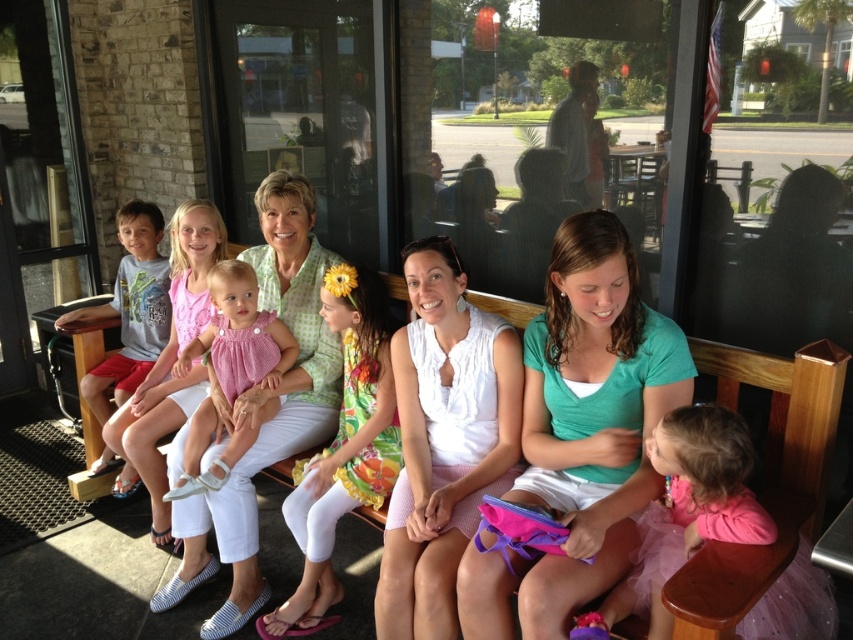
Is polka dot blouse at center positioned at the back of pink tulle skirt at lower right?

Yes.

Is polka dot blouse at center thinner than pink tulle skirt at lower right?

Incorrect, polka dot blouse at center's width is not less than pink tulle skirt at lower right's.

Is point (241, 400) closer to viewer compared to point (769, 534)?

No, (241, 400) is further to viewer.

Find the location of a particular element. The height and width of the screenshot is (640, 853). polka dot blouse at center is located at coordinates (263, 406).

Measure the distance from floral dress at center to pink tulle skirt at lower right.

floral dress at center and pink tulle skirt at lower right are 37.33 inches apart from each other.

Who is more distant from viewer, (383, 458) or (717, 518)?

The point (383, 458) is more distant.

Between point (297, 484) and point (683, 429), which one is positioned in front?

Point (683, 429) is more forward.

This screenshot has height=640, width=853. What are the coordinates of `floral dress at center` in the screenshot? It's located at (341, 448).

Is point (332, 508) positioned in front of point (216, 339)?

Yes, it is in front of point (216, 339).

Between point (360, 273) and point (268, 387), which one is positioned behind?

Positioned behind is point (268, 387).

Locate an element on the screen. floral dress at center is located at coordinates (341, 448).